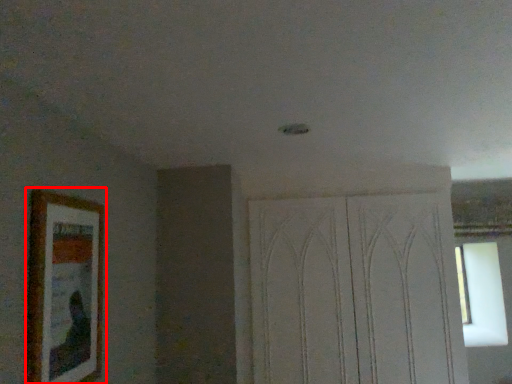
Question: From the image's perspective, where is picture frame (annotated by the red box) located in relation to screen door in the image?

Choices:
 (A) above
 (B) below

Answer: (A)